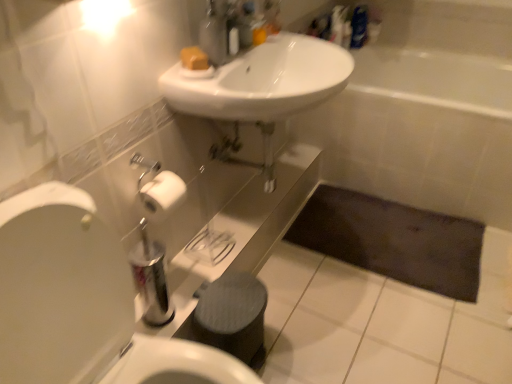
Question: From the image's perspective, relative to yellow matte soap at upper center, is white ceramic bathtub at center above or below?

Choices:
 (A) above
 (B) below

Answer: (B)

Question: Relative to yellow matte soap at upper center, is white ceramic bathtub at center in front or behind?

Choices:
 (A) front
 (B) behind

Answer: (B)

Question: Which is nearer to the yellow matte soap at upper center?

Choices:
 (A) white ceramic bathtub at center
 (B) white glossy sink at upper center
 (C) dark fabric bath mat at lower center
 (D) white glossy sink at center
 (E) matte plastic soap dispenser at upper center

Answer: (B)

Question: Based on their relative distances, which object is farther from the white ceramic bathtub at center?

Choices:
 (A) white glossy sink at upper center
 (B) white glossy toilet at left
 (C) dark fabric bath mat at lower center
 (D) matte plastic soap dispenser at upper center
 (E) yellow matte soap at upper center

Answer: (B)